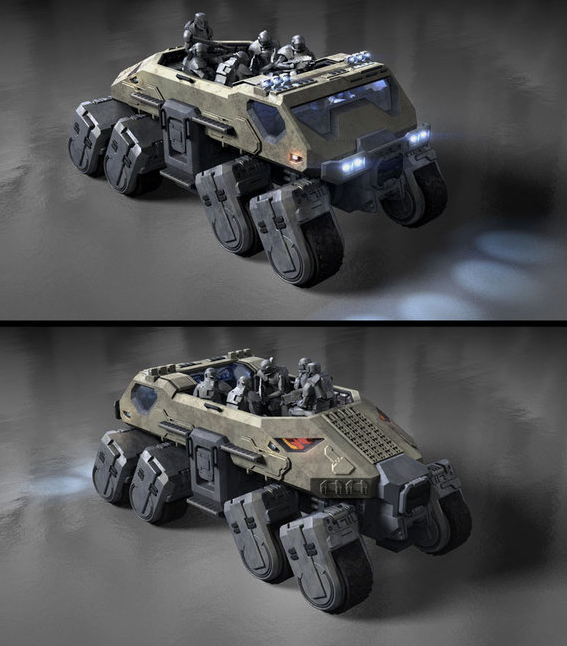
The image size is (567, 646). What are the coordinates of `light` in the screenshot? It's located at (357, 313), (417, 298), (490, 272), (495, 240), (50, 486), (82, 464).